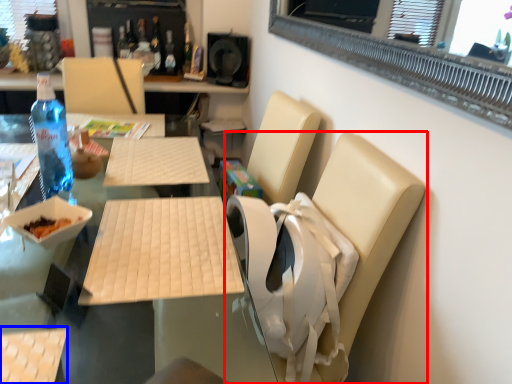
Question: Which object is closer to the camera taking this photo, chair (highlighted by a red box) or armchair (highlighted by a blue box)?

Choices:
 (A) chair
 (B) armchair

Answer: (B)